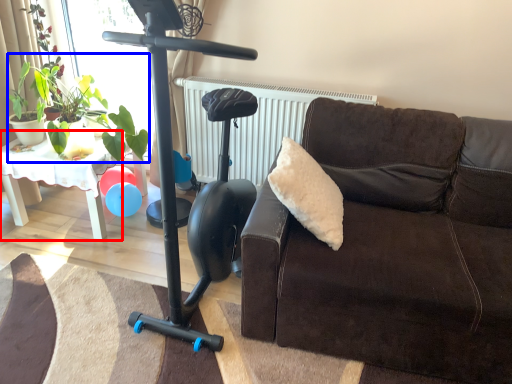
Question: Which of the following is the closest to the observer, table (highlighted by a red box) or plant (highlighted by a blue box)?

Choices:
 (A) table
 (B) plant

Answer: (B)